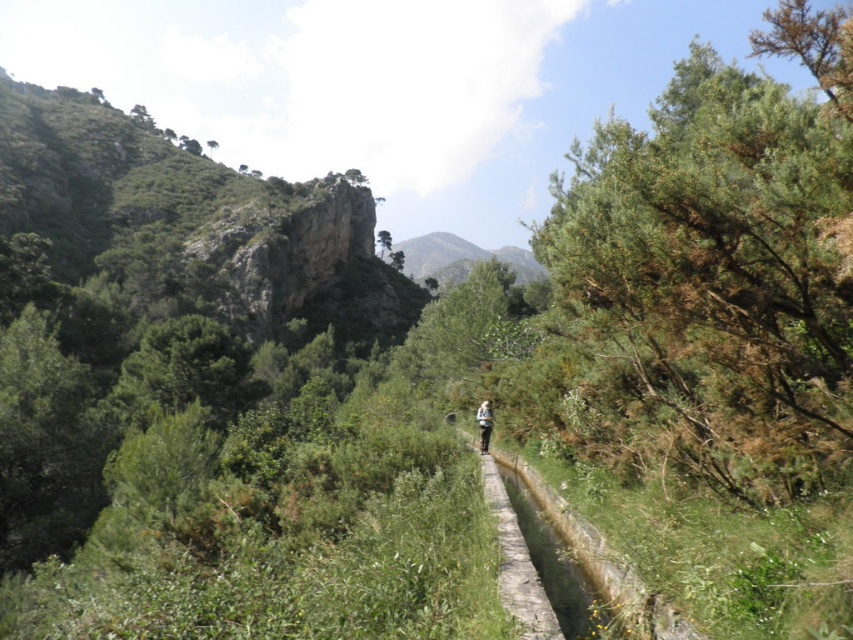
Is point (627, 468) closer to camera compared to point (491, 410)?

Yes, point (627, 468) is closer to viewer.

Which is more to the right, green leafy tree at right or light brown fabric backpack at center?

green leafy tree at right

Which is in front, point (743, 77) or point (491, 417)?

Point (743, 77)

Identify the location of green leafy tree at right. The image size is (853, 640). point(712,275).

How much distance is there between green leafy tree at right and rocky cliff at upper left?

The distance of green leafy tree at right from rocky cliff at upper left is 105.99 meters.

Between green leafy tree at right and rocky cliff at upper left, which one appears on the left side from the viewer's perspective?

Positioned to the left is rocky cliff at upper left.

Who is more forward, [701,52] or [171,189]?

Point [701,52] is in front.

Identify the location of green leafy tree at right. This screenshot has width=853, height=640. (712, 275).

Based on the photo, is rocky cliff at upper left below light brown fabric backpack at center?

Incorrect, rocky cliff at upper left is not positioned below light brown fabric backpack at center.

Does rocky cliff at upper left appear on the right side of light brown fabric backpack at center?

In fact, rocky cliff at upper left is to the left of light brown fabric backpack at center.

Which is in front, point (312, 218) or point (479, 412)?

Point (479, 412) is in front.

Identify the location of rocky cliff at upper left. Image resolution: width=853 pixels, height=640 pixels. (194, 220).